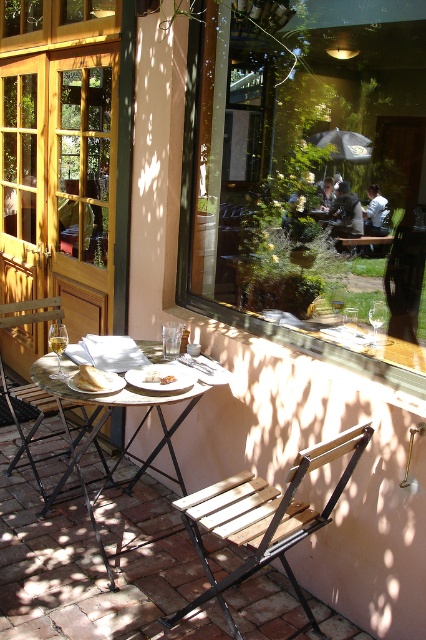
Question: Observing the image, what is the correct spatial positioning of transparent glass window at center in reference to wooden frame door at left?

Choices:
 (A) right
 (B) left

Answer: (A)

Question: Considering the relative positions of transparent glass window at center and wooden chair at left in the image provided, where is transparent glass window at center located with respect to wooden chair at left?

Choices:
 (A) below
 (B) above

Answer: (B)

Question: Which of the following is the closest to the observer?

Choices:
 (A) wooden slats at lower right
 (B) white porcelain plate at lower center
 (C) wooden frame door at left

Answer: (A)

Question: Which object appears closest to the camera in this image?

Choices:
 (A) white ceramic plate at center
 (B) wooden chair at left
 (C) white crumbly bread at table left

Answer: (A)

Question: Among these objects, which one is nearest to the camera?

Choices:
 (A) white porcelain plate at lower center
 (B) wooden slats at lower right

Answer: (B)

Question: Does wooden slats at lower right have a greater width compared to white porcelain plate at lower center?

Choices:
 (A) no
 (B) yes

Answer: (B)